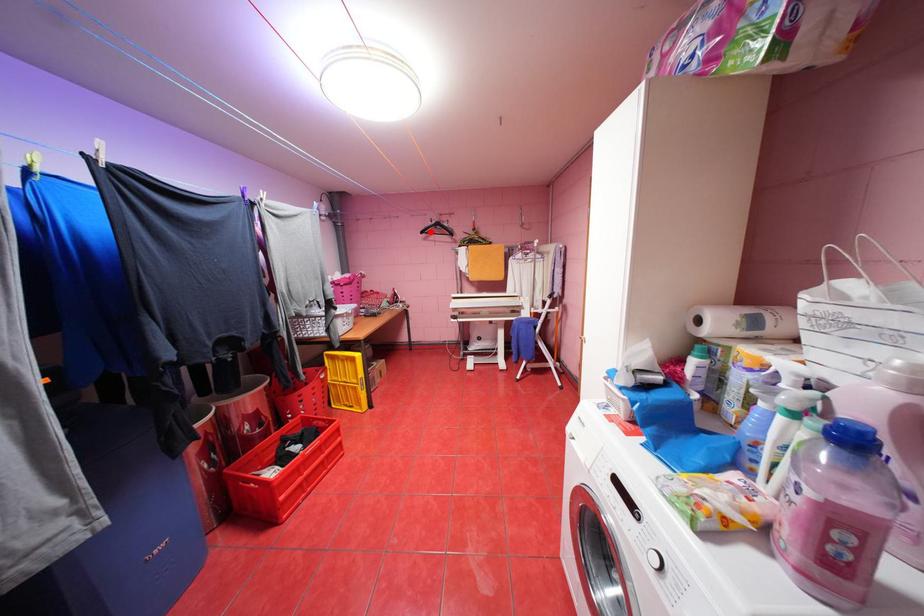
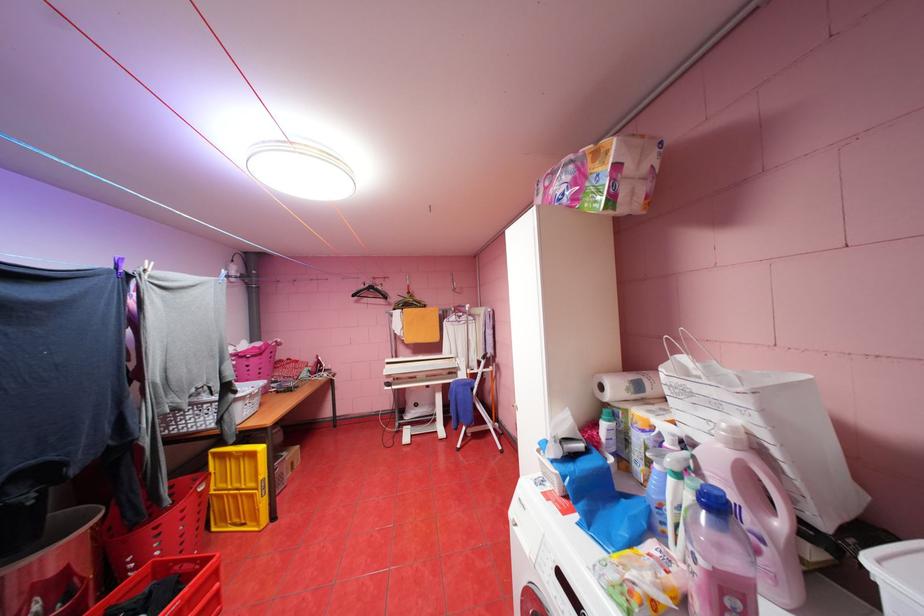
Locate, in the second image, the point that corresponds to the highlighted location in the first image.

(361, 294)